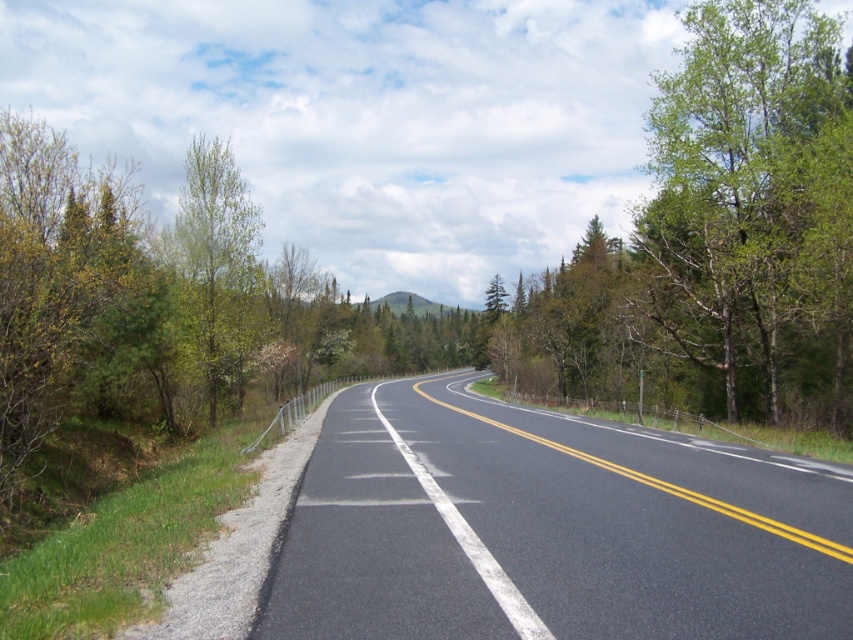
Question: Which point is closer to the camera taking this photo?

Choices:
 (A) (627, 545)
 (B) (763, 90)
 (C) (196, 161)

Answer: (A)

Question: Which is farther from the green leafy tree at right?

Choices:
 (A) black asphalt road at center
 (B) green leafy tree at left

Answer: (B)

Question: Which point is closer to the camera?

Choices:
 (A) green leafy tree at right
 (B) green leafy tree at left
 (C) black asphalt road at center

Answer: (C)

Question: Is green leafy tree at right further to camera compared to green leafy tree at left?

Choices:
 (A) yes
 (B) no

Answer: (B)

Question: In this image, where is black asphalt road at center located relative to green leafy tree at left?

Choices:
 (A) above
 (B) below

Answer: (B)

Question: Is black asphalt road at center above green leafy tree at right?

Choices:
 (A) no
 (B) yes

Answer: (A)